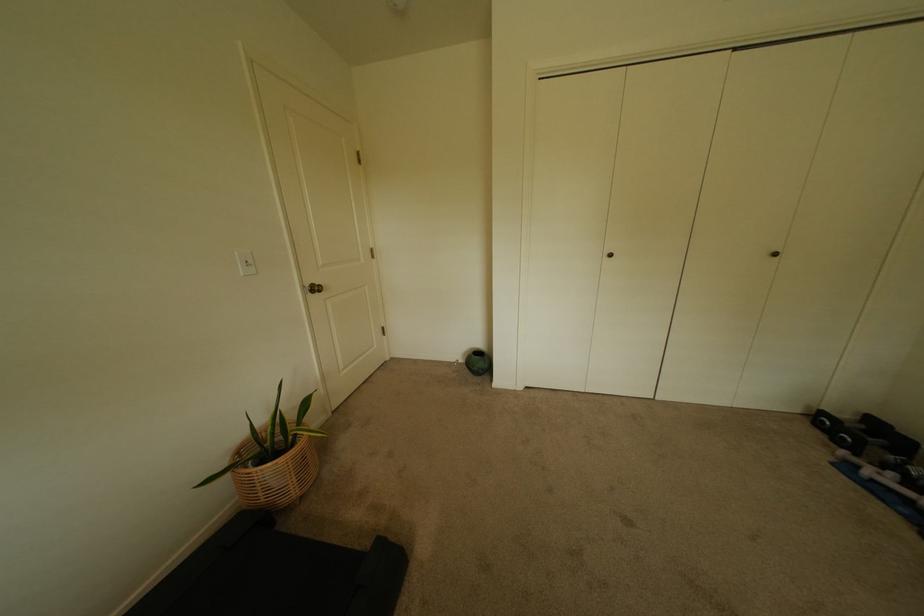
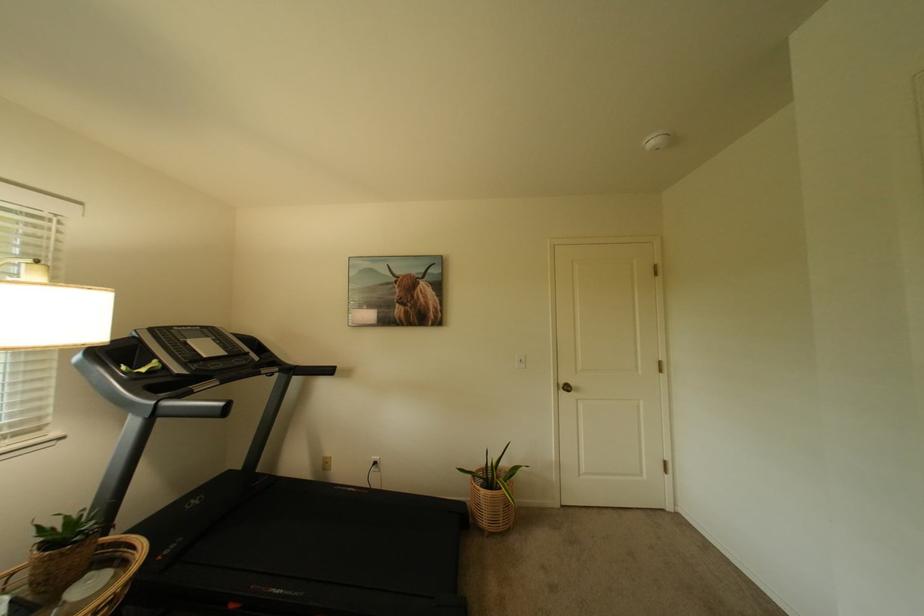
The point at (x=315, y=288) is marked in the first image. Where is the corresponding point in the second image?

(569, 386)